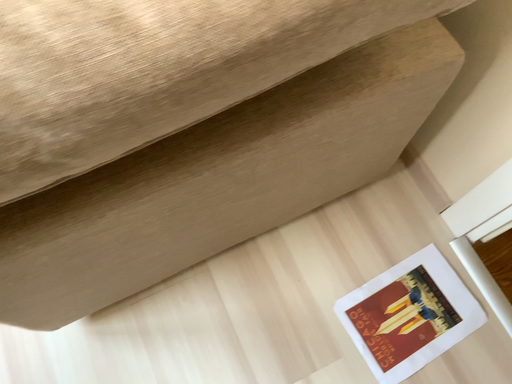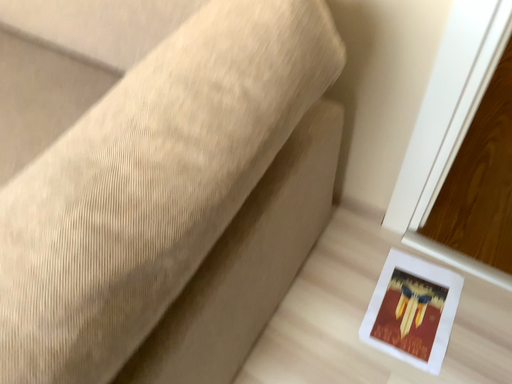
Question: Which way did the camera rotate in the video?

Choices:
 (A) rotated left
 (B) rotated right

Answer: (B)